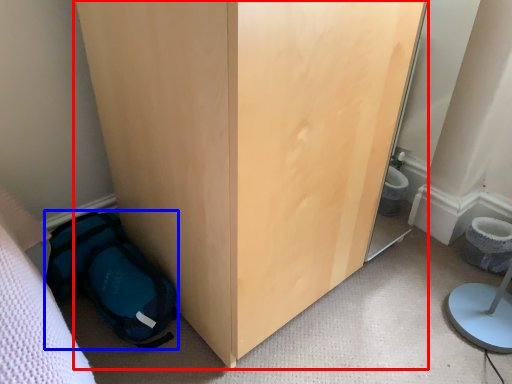
Question: Among these objects, which one is farthest to the camera, furniture (highlighted by a red box) or backpack (highlighted by a blue box)?

Choices:
 (A) furniture
 (B) backpack

Answer: (B)